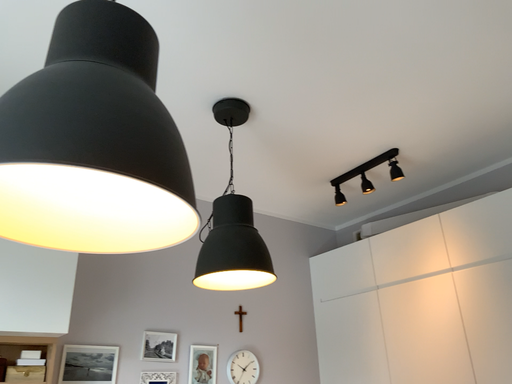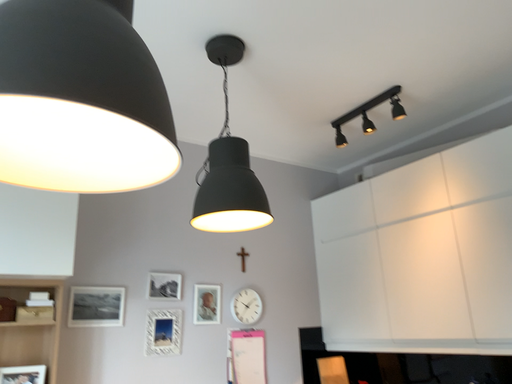
Question: How did the camera likely rotate when shooting the video?

Choices:
 (A) rotated upward
 (B) rotated downward

Answer: (B)